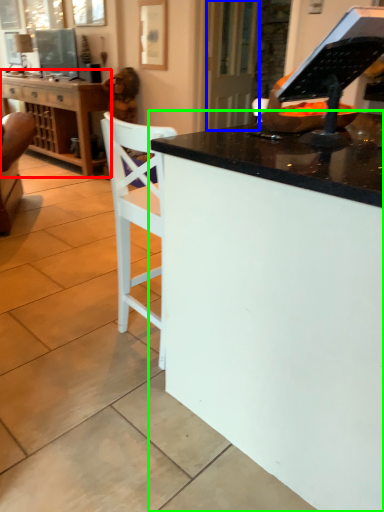
Question: Considering the real-world distances, which object is closest to cabinetry (highlighted by a red box)? glass door (highlighted by a blue box) or desk (highlighted by a green box).

Choices:
 (A) glass door
 (B) desk

Answer: (A)